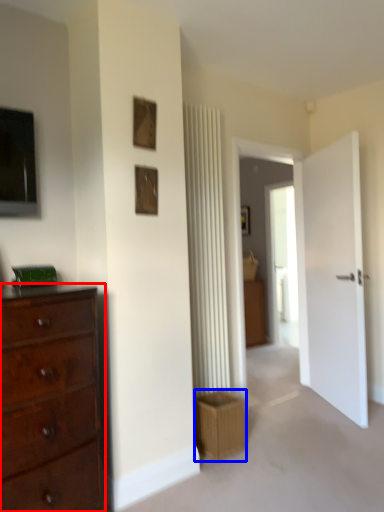
Question: Which of the following is the farthest to the observer, chest of drawers (highlighted by a red box) or crate (highlighted by a blue box)?

Choices:
 (A) chest of drawers
 (B) crate

Answer: (B)